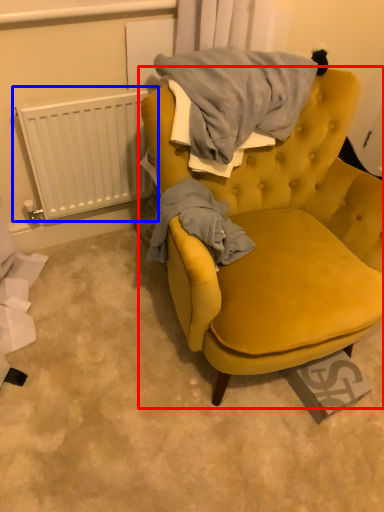
Question: Which object is further to the camera taking this photo, chair (highlighted by a red box) or radiator (highlighted by a blue box)?

Choices:
 (A) chair
 (B) radiator

Answer: (B)